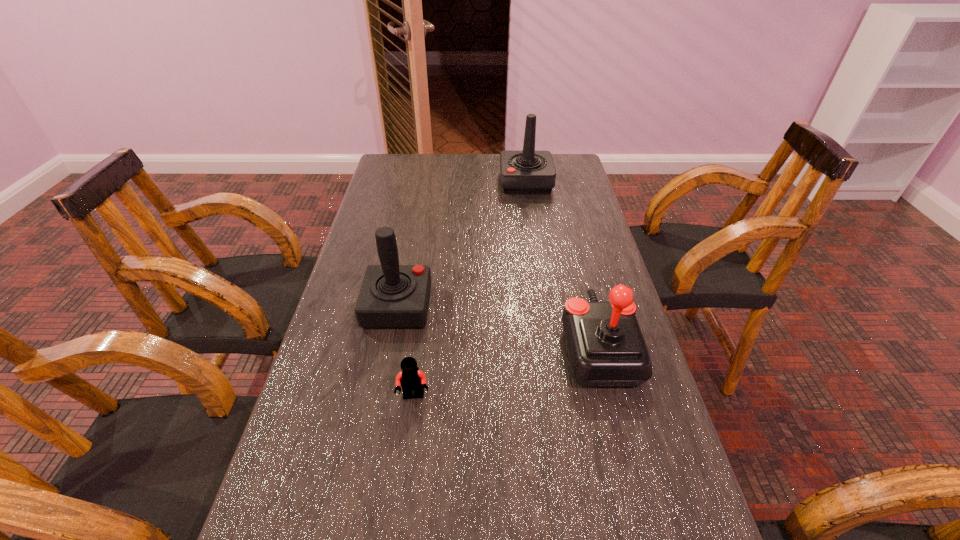
At what (x,y) coordinates should I click in order to perform the action: click on object located at the far right corner. Please return your answer as a coordinate pair (x, y). Image resolution: width=960 pixels, height=540 pixels. Looking at the image, I should click on (522, 172).

Where is `free space at the far edge of the desktop`? free space at the far edge of the desktop is located at coordinates (477, 184).

Image resolution: width=960 pixels, height=540 pixels. Find the location of `free space at the left edge of the desktop`. free space at the left edge of the desktop is located at coordinates (390, 205).

Find the location of a particular element. The image size is (960, 540). blank space at the right edge of the desktop is located at coordinates (562, 282).

In order to click on free region at the far right corner of the desktop in this screenshot , I will do `click(581, 170)`.

Find the location of a particular element. object that is the third closest to the leftmost joystick is located at coordinates (522, 172).

Locate which object ranks third in proximity to the farthest joystick. Please provide its 2D coordinates. Your answer should be formatted as a tuple, i.e. [(x, y)], where the tuple contains the x and y coordinates of a point satisfying the conditions above.

[(411, 379)]

Locate an element on the screen. Image resolution: width=960 pixels, height=540 pixels. joystick that is the second closest to the leftmost joystick is located at coordinates (522, 172).

Locate an element on the screen. The image size is (960, 540). the closest joystick relative to the leftmost joystick is located at coordinates (606, 348).

The image size is (960, 540). I want to click on vacant space that satisfies the following two spatial constraints: 1. on the front-facing side of the farthest object; 2. on the front-facing side of the Lego, so click(558, 396).